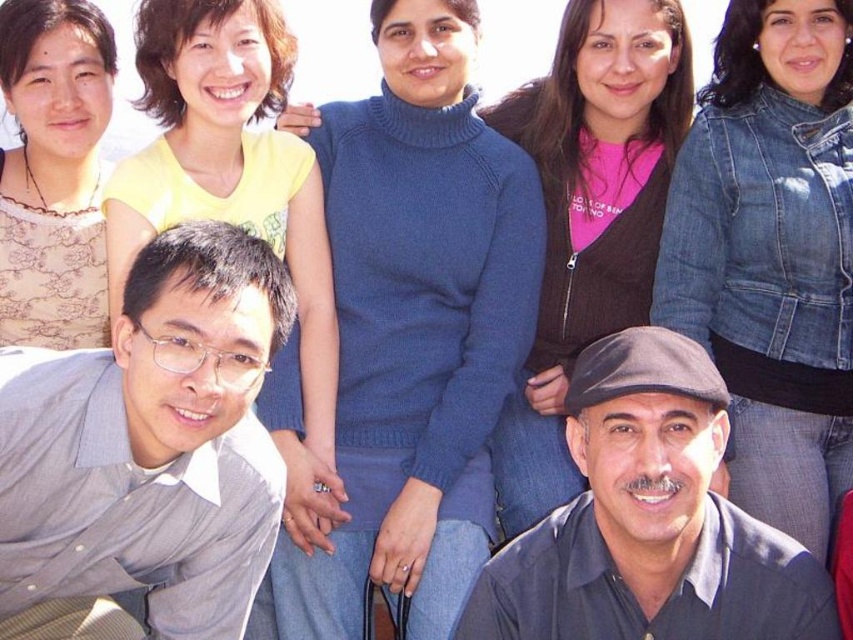
Question: Which object is closer to the camera taking this photo?

Choices:
 (A) gray shirt at lower left
 (B) dark gray fabric at lower right

Answer: (A)

Question: Which point is farther to the camera?

Choices:
 (A) gray shirt at lower left
 (B) dark gray fabric at lower right

Answer: (B)

Question: Is gray shirt at lower left above dark gray fabric at lower right?

Choices:
 (A) no
 (B) yes

Answer: (B)

Question: Can you confirm if gray shirt at lower left is bigger than dark gray fabric at lower right?

Choices:
 (A) yes
 (B) no

Answer: (A)

Question: Is gray shirt at lower left closer to camera compared to dark gray fabric at lower right?

Choices:
 (A) yes
 (B) no

Answer: (A)